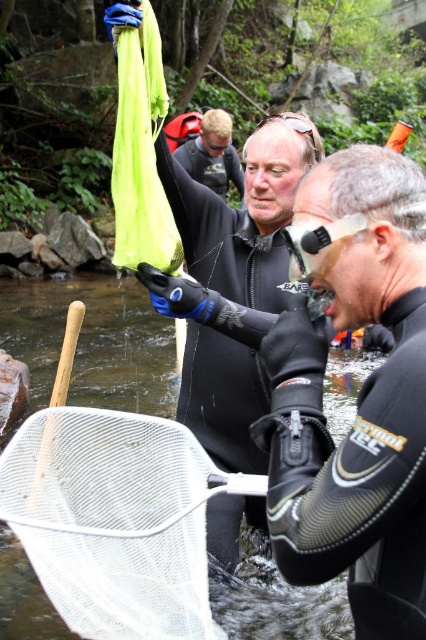
Where is the black neoprene wetsuit at center located in the image?

The black neoprene wetsuit at center is located at point coordinates of (357, 400).

You are a photographer trying to capture both the black neoprene wetsuit at center and the black wetsuit at center in a single frame. Which one should you focus on first to ensure they are both in focus?

The black neoprene wetsuit at center has a smaller size compared to black wetsuit at center, so you should focus on the larger black wetsuit at center first to ensure both are in focus.